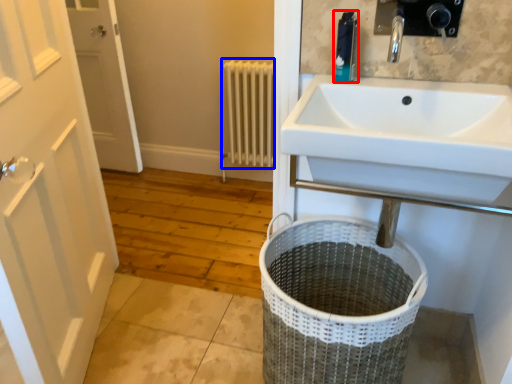
Question: Which point is further to the camera, toiletry (highlighted by a red box) or radiator (highlighted by a blue box)?

Choices:
 (A) toiletry
 (B) radiator

Answer: (B)